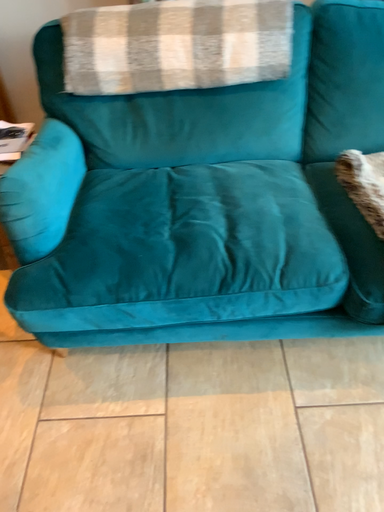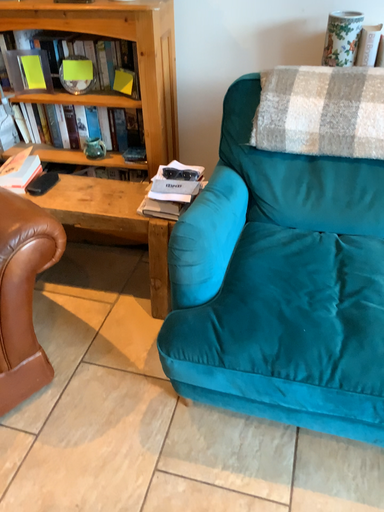
Question: Which way did the camera rotate in the video?

Choices:
 (A) rotated right
 (B) rotated left

Answer: (B)